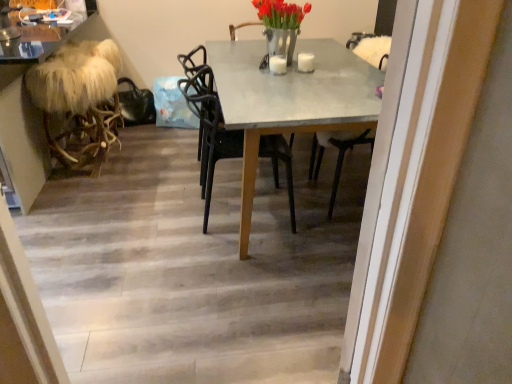
You are a GUI agent. You are given a task and a screenshot of the screen. Output one action in this format:
    pyautogui.click(x=<x>, y=<y>)
    Task: Click on the free space in front of concrete gray table at center
    
    Given the screenshot: What is the action you would take?
    pyautogui.click(x=212, y=298)